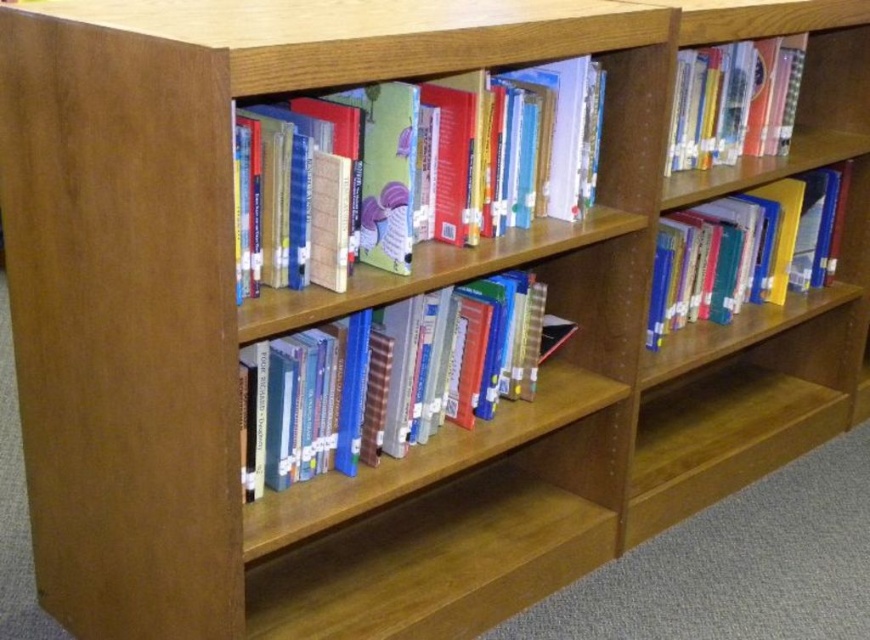
Question: Which object is farther from the camera taking this photo?

Choices:
 (A) hardcover book at upper right
 (B) yellow matte book at upper right
 (C) hardcover books at center
 (D) hardcover book at center

Answer: (A)

Question: Which point appears farthest from the camera in this image?

Choices:
 (A) (393, 444)
 (B) (810, 170)
 (C) (480, 204)
 (D) (740, 141)

Answer: (B)

Question: Can you confirm if hardcover book at center is thinner than hardcover books at center?

Choices:
 (A) yes
 (B) no

Answer: (B)

Question: Is hardcover book at center thinner than hardcover book at upper right?

Choices:
 (A) yes
 (B) no

Answer: (B)

Question: Is hardcover books at center to the right of yellow matte book at upper right from the viewer's perspective?

Choices:
 (A) no
 (B) yes

Answer: (A)

Question: Which is farther from the yellow matte book at upper right?

Choices:
 (A) hardcover book at center
 (B) hardcover book at upper right
 (C) hardcover books at center

Answer: (C)